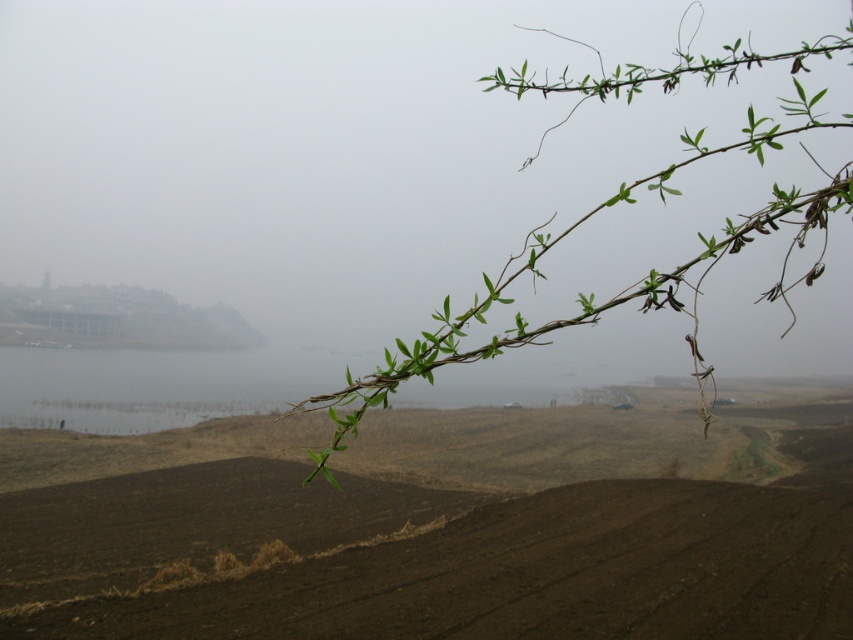
Question: Is brown soil at center smaller than green leafy branch at upper right?

Choices:
 (A) yes
 (B) no

Answer: (A)

Question: Which point is closer to the camera taking this photo?

Choices:
 (A) (495, 440)
 (B) (322, 465)

Answer: (B)

Question: Among these points, which one is nearest to the camera?

Choices:
 (A) (273, 496)
 (B) (764, 298)

Answer: (B)

Question: Can you confirm if brown soil at center is thinner than green leafy branch at upper right?

Choices:
 (A) no
 (B) yes

Answer: (B)

Question: Does brown soil at center have a lesser width compared to green leafy branch at upper right?

Choices:
 (A) yes
 (B) no

Answer: (A)

Question: Which point is farther to the camera?

Choices:
 (A) brown soil at center
 (B) green leafy branch at upper right

Answer: (A)